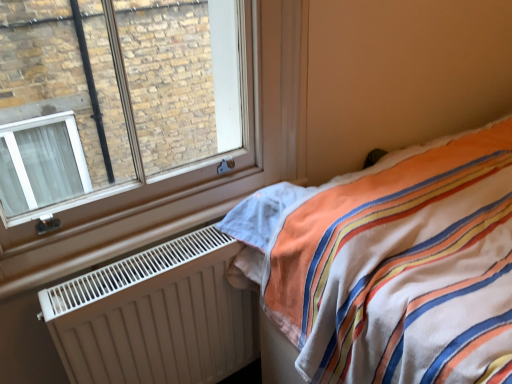
This screenshot has height=384, width=512. I want to click on clear glass window at upper left, so click(x=114, y=97).

Find the location of a particular element. Image resolution: width=512 pixels, height=384 pixels. clear glass window at upper left is located at coordinates (114, 97).

Are white matte radiator at lower left and clear glass window at upper left located far from each other?

Yes, white matte radiator at lower left is far from clear glass window at upper left.

Considering the positions of objects white matte radiator at lower left and clear glass window at upper left in the image provided, who is behind, white matte radiator at lower left or clear glass window at upper left?

white matte radiator at lower left is behind.

Is white matte radiator at lower left bigger or smaller than clear glass window at upper left?

Clearly, white matte radiator at lower left is smaller in size than clear glass window at upper left.

Locate an element on the screen. The image size is (512, 384). window that appears above the white matte radiator at lower left (from the image's perspective) is located at coordinates [x=114, y=97].

Which is in front, striped cotton bed at right or white matte radiator at lower left?

striped cotton bed at right.

From the image's perspective, which one is positioned lower, striped cotton bed at right or white matte radiator at lower left?

From the image's view, white matte radiator at lower left is below.

Is striped cotton bed at right in contact with white matte radiator at lower left?

They are not placed beside each other.

Measure the distance from clear glass window at upper left to white matte radiator at lower left.

A distance of 3.49 meters exists between clear glass window at upper left and white matte radiator at lower left.

Is point (18, 33) closer or farther from the camera than point (189, 317)?

Point (18, 33).

Between clear glass window at upper left and white matte radiator at lower left, which one has smaller size?

With smaller size is white matte radiator at lower left.

Considering the relative sizes of clear glass window at upper left and white matte radiator at lower left in the image provided, is clear glass window at upper left taller than white matte radiator at lower left?

Yes, clear glass window at upper left is taller than white matte radiator at lower left.

Which object is closer to the camera taking this photo, white matte radiator at lower left or striped cotton bed at right?

striped cotton bed at right is more forward.

Is white matte radiator at lower left with striped cotton bed at right?

No, white matte radiator at lower left is not beside striped cotton bed at right.

Identify the location of bed above the white matte radiator at lower left (from a real-world perspective). The width and height of the screenshot is (512, 384). 400,268.

Would you say white matte radiator at lower left is to the left or to the right of striped cotton bed at right in the picture?

white matte radiator at lower left is to the left of striped cotton bed at right.

In the scene shown: Which object is further away from the camera, striped cotton bed at right or clear glass window at upper left?

clear glass window at upper left is behind.

Is striped cotton bed at right spatially inside clear glass window at upper left, or outside of it?

striped cotton bed at right lies outside clear glass window at upper left.

From a real-world perspective, who is located lower, striped cotton bed at right or clear glass window at upper left?

striped cotton bed at right, from a real-world perspective.

Is striped cotton bed at right looking in the opposite direction of clear glass window at upper left?

No, striped cotton bed at right's orientation is not away from clear glass window at upper left.

Considering the relative sizes of clear glass window at upper left and striped cotton bed at right in the image provided, is clear glass window at upper left shorter than striped cotton bed at right?

Indeed, clear glass window at upper left has a lesser height compared to striped cotton bed at right.

Is striped cotton bed at right at the back of clear glass window at upper left?

clear glass window at upper left does not have its back to striped cotton bed at right.

Is clear glass window at upper left further to camera compared to striped cotton bed at right?

Yes, clear glass window at upper left is further from the viewer.

Is clear glass window at upper left in contact with striped cotton bed at right?

No, clear glass window at upper left is not with striped cotton bed at right.

At what (x,y) coordinates should I click in order to perform the action: click on radiator behind the clear glass window at upper left. Please return your answer as a coordinate pair (x, y). The height and width of the screenshot is (384, 512). Looking at the image, I should click on (155, 316).

Identify the location of radiator on the left of striped cotton bed at right. The image size is (512, 384). (155, 316).

In the scene shown: When comparing their distances from white matte radiator at lower left, does clear glass window at upper left or striped cotton bed at right seem closer?

Based on the image, striped cotton bed at right appears to be nearer to white matte radiator at lower left.

Based on their spatial positions, is striped cotton bed at right or clear glass window at upper left closer to white matte radiator at lower left?

striped cotton bed at right lies closer to white matte radiator at lower left than the other object.

Looking at the image, which one is located closer to clear glass window at upper left, striped cotton bed at right or white matte radiator at lower left?

white matte radiator at lower left is closer to clear glass window at upper left.

Based on their spatial positions, is white matte radiator at lower left or clear glass window at upper left further from striped cotton bed at right?

clear glass window at upper left lies further to striped cotton bed at right than the other object.

When comparing their distances from clear glass window at upper left, does white matte radiator at lower left or striped cotton bed at right seem closer?

Based on the image, white matte radiator at lower left appears to be nearer to clear glass window at upper left.

When comparing their distances from striped cotton bed at right, does clear glass window at upper left or white matte radiator at lower left seem further?

clear glass window at upper left is positioned further to the anchor striped cotton bed at right.

The height and width of the screenshot is (384, 512). What are the coordinates of `window between white matte radiator at lower left and striped cotton bed at right` in the screenshot? It's located at (114, 97).